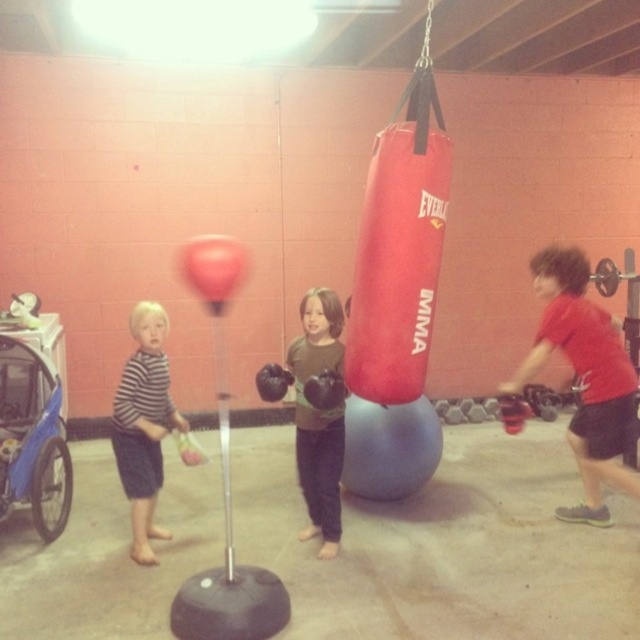
Question: Which object is positioned farthest from the red matte boxing glove at right?

Choices:
 (A) matte black boxing gloves at center
 (B) striped cotton shirt at left

Answer: (B)

Question: Does red matte boxing glove at right have a greater width compared to matte black boxing gloves at center?

Choices:
 (A) no
 (B) yes

Answer: (B)

Question: Estimate the real-world distances between objects in this image. Which object is closer to the striped cotton shirt at left?

Choices:
 (A) matte black boxing gloves at center
 (B) red matte boxing glove at right

Answer: (A)

Question: Can you confirm if red matte boxing glove at right is thinner than matte black boxing gloves at center?

Choices:
 (A) yes
 (B) no

Answer: (B)

Question: Which object is the farthest from the matte black boxing gloves at center?

Choices:
 (A) red matte boxing glove at right
 (B) striped cotton shirt at left

Answer: (A)

Question: In this image, where is matte black boxing gloves at center located relative to striped cotton shirt at left?

Choices:
 (A) right
 (B) left

Answer: (A)